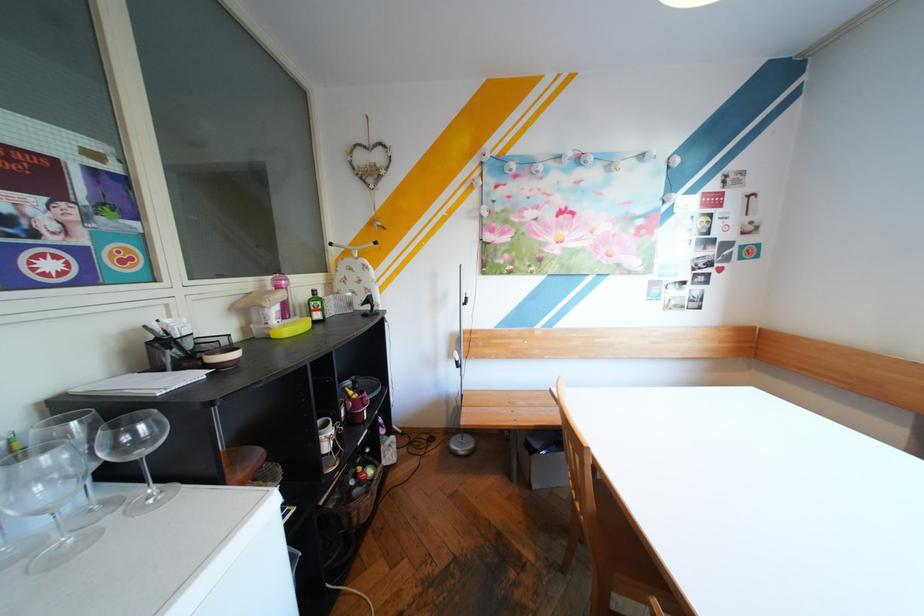
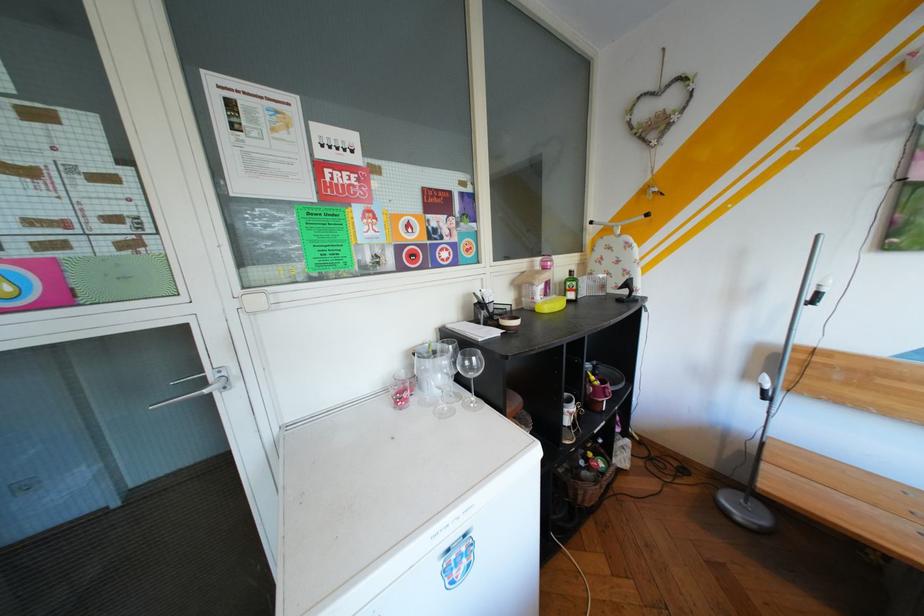
The point at (x=469, y=361) is marked in the first image. Where is the corresponding point in the second image?

(776, 390)